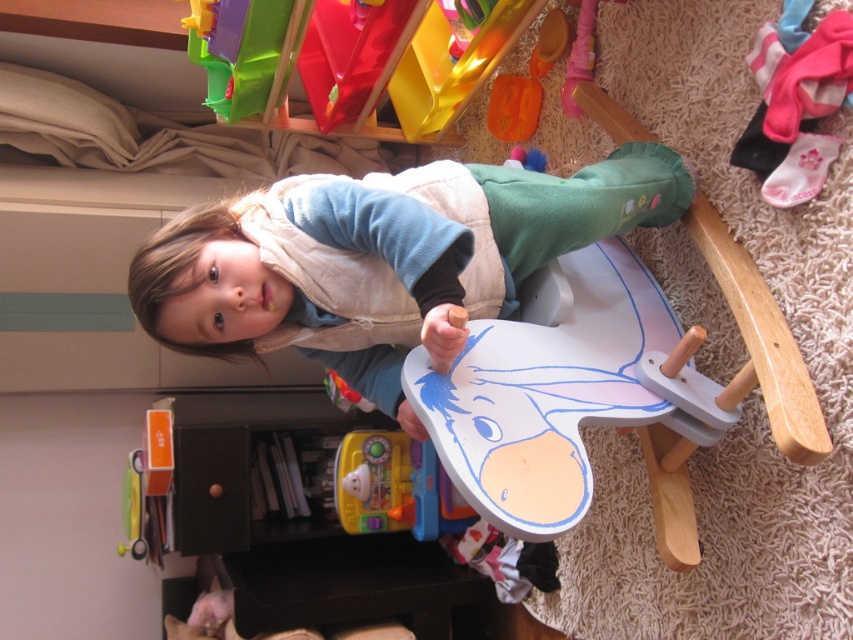
Question: Is matte white vest at center below brown matte drawer at lower left?

Choices:
 (A) yes
 (B) no

Answer: (B)

Question: Which point is closer to the camera?

Choices:
 (A) wooden rocking horse at lower right
 (B) metallic yellow toy at lower left
 (C) yellow plastic toy at lower center

Answer: (A)

Question: Estimate the real-world distances between objects in this image. Which object is closer to the wooden rocking horse at lower right?

Choices:
 (A) matte white vest at center
 (B) metallic yellow toy at lower left
 (C) brown matte drawer at lower left

Answer: (A)

Question: Is wooden rocking horse at lower right to the left of yellow plastic toy at lower center from the viewer's perspective?

Choices:
 (A) yes
 (B) no

Answer: (B)

Question: Is matte white vest at center smaller than yellow plastic toy at lower center?

Choices:
 (A) no
 (B) yes

Answer: (A)

Question: Considering the real-world distances, which object is closest to the yellow plastic toy at lower center?

Choices:
 (A) metallic yellow toy at lower left
 (B) wooden rocking horse at lower right
 (C) matte white vest at center
 (D) brown matte drawer at lower left

Answer: (D)